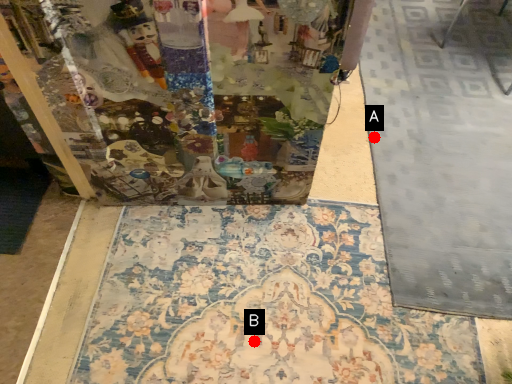
Question: Two points are circled on the image, labeled by A and B beside each circle. Which point is further to the camera?

Choices:
 (A) A is further
 (B) B is further

Answer: (A)